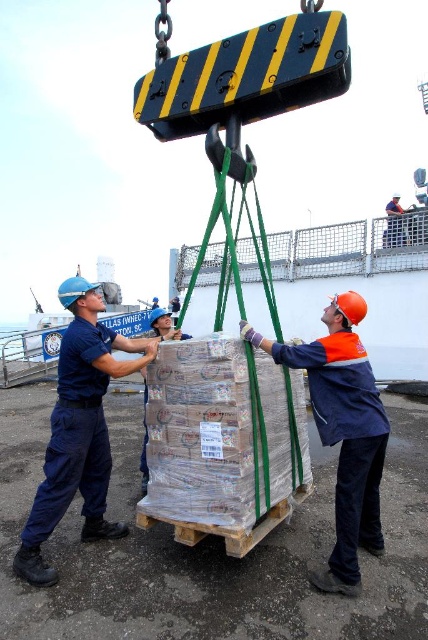
Question: Which point is closer to the camera?

Choices:
 (A) orange hard hat at center
 (B) blue uniform at center

Answer: (A)

Question: Is blue uniform at center positioned before orange hard hat at center?

Choices:
 (A) no
 (B) yes

Answer: (A)

Question: Which of these objects is positioned closest to the orange hard hat at center?

Choices:
 (A) blue uniform at center
 (B) orange hard hat at upper center

Answer: (A)

Question: Can you confirm if blue uniform at center is bigger than orange hard hat at upper center?

Choices:
 (A) no
 (B) yes

Answer: (A)

Question: Which point is closer to the camera?

Choices:
 (A) orange hard hat at center
 (B) blue uniform at center

Answer: (A)

Question: Is blue uniform at center bigger than orange hard hat at upper center?

Choices:
 (A) no
 (B) yes

Answer: (A)